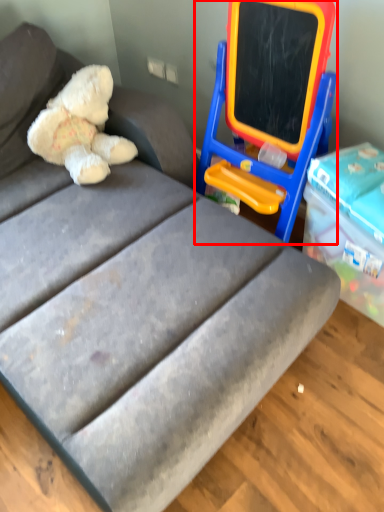
Question: Where is equipment (annotated by the red box) located in relation to teddy bear in the image?

Choices:
 (A) left
 (B) right

Answer: (B)